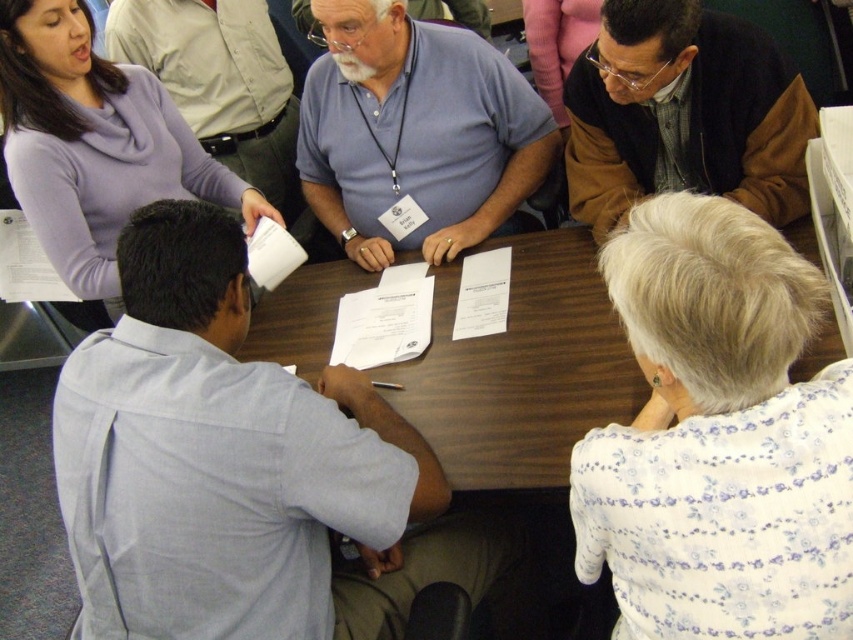
Which is more to the right, matte purple sweater at upper left or matte gray shirt at upper left?

Positioned to the right is matte gray shirt at upper left.

Is matte purple sweater at upper left shorter than matte gray shirt at upper left?

Incorrect, matte purple sweater at upper left's height does not fall short of matte gray shirt at upper left's.

Who is more forward, (15, 45) or (195, 6)?

Point (15, 45)

I want to click on matte purple sweater at upper left, so click(x=96, y=145).

Find the location of a particular element. matte blue shirt at center is located at coordinates (415, 132).

Which is above, matte blue shirt at center or dark brown jacket at upper right?

matte blue shirt at center

Who is more distant from viewer, (454, 172) or (567, 106)?

The point (454, 172) is more distant.

Image resolution: width=853 pixels, height=640 pixels. Identify the location of matte blue shirt at center. [415, 132].

Is the position of light blue shirt at center more distant than that of matte blue shirt at center?

No, light blue shirt at center is closer to the viewer.

Which of these two, light blue shirt at center or matte blue shirt at center, stands taller?

Standing taller between the two is light blue shirt at center.

Which is in front, point (160, 248) or point (505, 150)?

Point (160, 248)

This screenshot has width=853, height=640. Identify the location of light blue shirt at center. (241, 468).